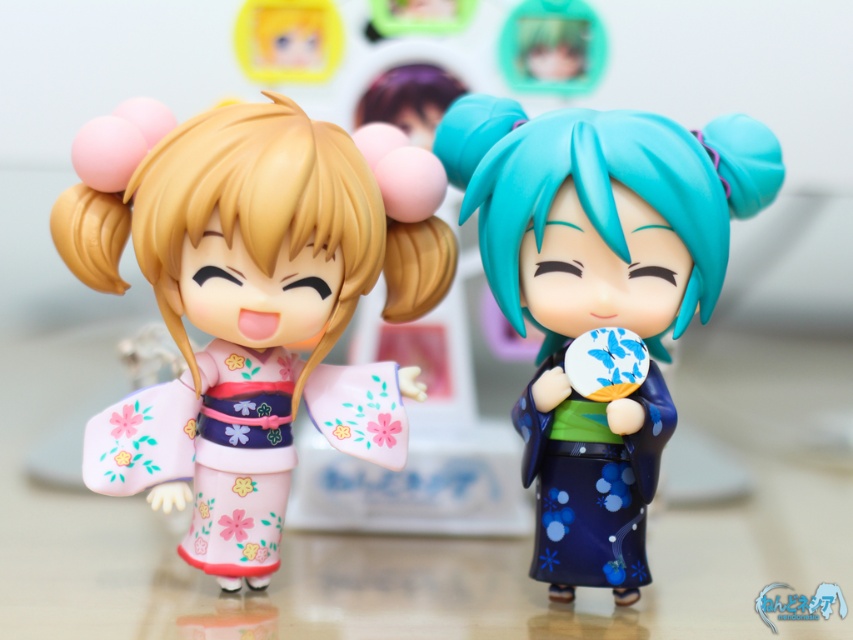
Which is in front, point (375, 260) or point (531, 163)?

Point (531, 163) is more forward.

Between pink matte kimono at left and blue glossy kimono at center, which one has more height?

Standing taller between the two is blue glossy kimono at center.

In order to click on pink matte kimono at left in this screenshot , I will do `click(250, 316)`.

Locate an element on the screen. Image resolution: width=853 pixels, height=640 pixels. pink matte kimono at left is located at coordinates (250, 316).